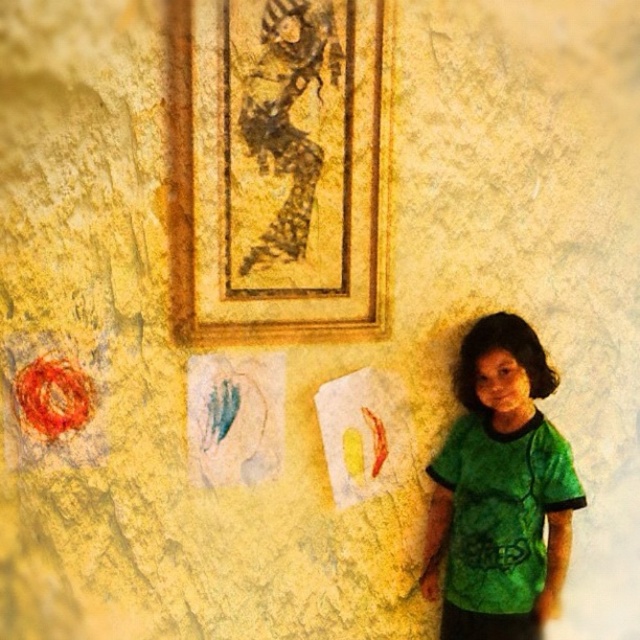
In the scene shown: Which is below, gold textured picture frame at upper center or green tie-dye shirt at right?

Positioned lower is green tie-dye shirt at right.

Is the position of gold textured picture frame at upper center more distant than that of green tie-dye shirt at right?

No, gold textured picture frame at upper center is closer to the viewer.

Is point (291, 64) more distant than point (509, 333)?

No, it is in front of (509, 333).

This screenshot has width=640, height=640. What are the coordinates of `gold textured picture frame at upper center` in the screenshot? It's located at (278, 168).